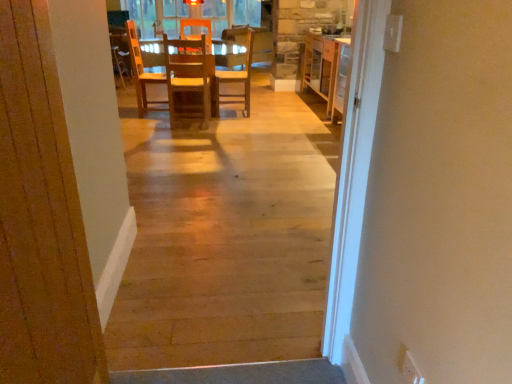
Question: Should I look upward or downward to see wooden chair at center, acting as the first chair starting from the right?

Choices:
 (A) up
 (B) down

Answer: (A)

Question: Is wooden door at center turned away from wooden chair at center, acting as the 2th chair starting from the right?

Choices:
 (A) no
 (B) yes

Answer: (A)

Question: Can you confirm if wooden door at center is bigger than wooden chair at center, acting as the first chair starting from the left?

Choices:
 (A) no
 (B) yes

Answer: (A)

Question: Is wooden door at center next to wooden chair at center, acting as the first chair starting from the left?

Choices:
 (A) no
 (B) yes

Answer: (A)

Question: Can you confirm if wooden door at center is positioned to the right of wooden chair at center, acting as the first chair starting from the left?

Choices:
 (A) no
 (B) yes

Answer: (B)

Question: Can you confirm if wooden door at center is shorter than wooden chair at center, acting as the 2th chair starting from the right?

Choices:
 (A) no
 (B) yes

Answer: (A)

Question: Does wooden door at center have a smaller size compared to wooden chair at center, acting as the first chair starting from the left?

Choices:
 (A) yes
 (B) no

Answer: (A)

Question: Does wooden chair at center, acting as the 2th chair starting from the right, have a larger size compared to natural wood floor at center?

Choices:
 (A) yes
 (B) no

Answer: (A)

Question: Does wooden chair at center, acting as the 2th chair starting from the right, have a greater height compared to natural wood floor at center?

Choices:
 (A) yes
 (B) no

Answer: (B)

Question: Is wooden chair at center, acting as the 2th chair starting from the right, not within natural wood floor at center?

Choices:
 (A) no
 (B) yes

Answer: (B)

Question: Can you confirm if wooden chair at center, acting as the first chair starting from the left, is thinner than natural wood floor at center?

Choices:
 (A) no
 (B) yes

Answer: (A)

Question: Can you confirm if wooden chair at center, acting as the first chair starting from the left, is shorter than natural wood floor at center?

Choices:
 (A) no
 (B) yes

Answer: (B)

Question: Considering the relative positions of wooden chair at center, acting as the 2th chair starting from the right, and natural wood floor at center in the image provided, is wooden chair at center, acting as the 2th chair starting from the right, behind natural wood floor at center?

Choices:
 (A) no
 (B) yes

Answer: (B)

Question: Is the depth of natural wood floor at center less than that of wooden cabinet at center?

Choices:
 (A) no
 (B) yes

Answer: (B)